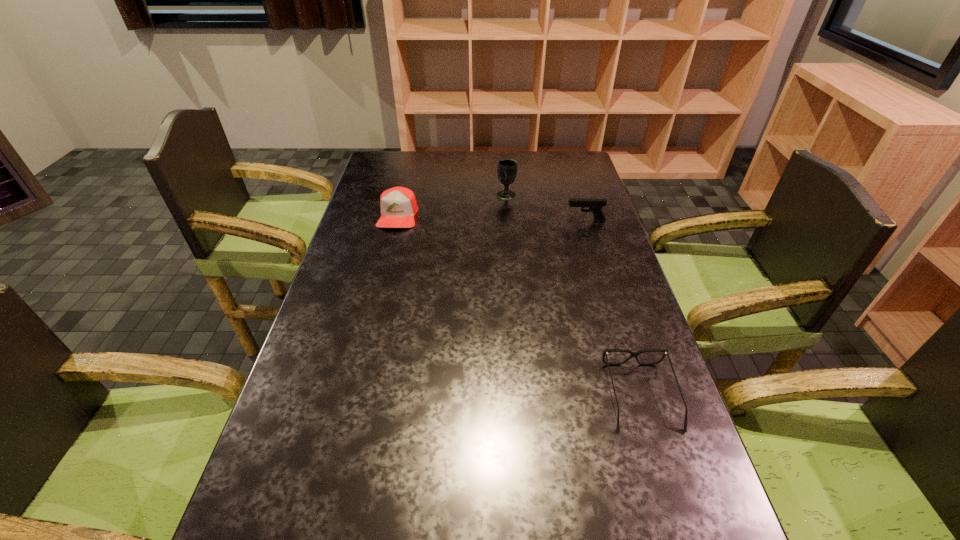
At what (x,y) coordinates should I click in order to perform the action: click on free space located on the front-facing side of the baseball cap. Please return your answer as a coordinate pair (x, y). Looking at the image, I should click on click(x=372, y=320).

In order to click on vacant space located 0.060m with the lenses facing outward on the nearest object in this screenshot , I will do `click(660, 462)`.

Image resolution: width=960 pixels, height=540 pixels. Identify the location of object at the left edge. (398, 206).

Where is `pistol situated at the right edge`? The height and width of the screenshot is (540, 960). pistol situated at the right edge is located at coordinates (595, 205).

The height and width of the screenshot is (540, 960). Find the location of `spectacles at the right edge`. spectacles at the right edge is located at coordinates (633, 354).

This screenshot has height=540, width=960. In order to click on vacant point at the far edge in this screenshot , I will do `click(534, 171)`.

Where is `vacant space at the left edge of the desktop`? vacant space at the left edge of the desktop is located at coordinates (290, 519).

Locate an element on the screen. The height and width of the screenshot is (540, 960). free region at the right edge of the desktop is located at coordinates (593, 195).

Locate an element on the screen. The image size is (960, 540). vacant space at the far left corner of the desktop is located at coordinates point(379,153).

At what (x,y) coordinates should I click in order to perform the action: click on empty location between the baseball cap and the pistol. Please return your answer as a coordinate pair (x, y). Image resolution: width=960 pixels, height=540 pixels. Looking at the image, I should click on (492, 218).